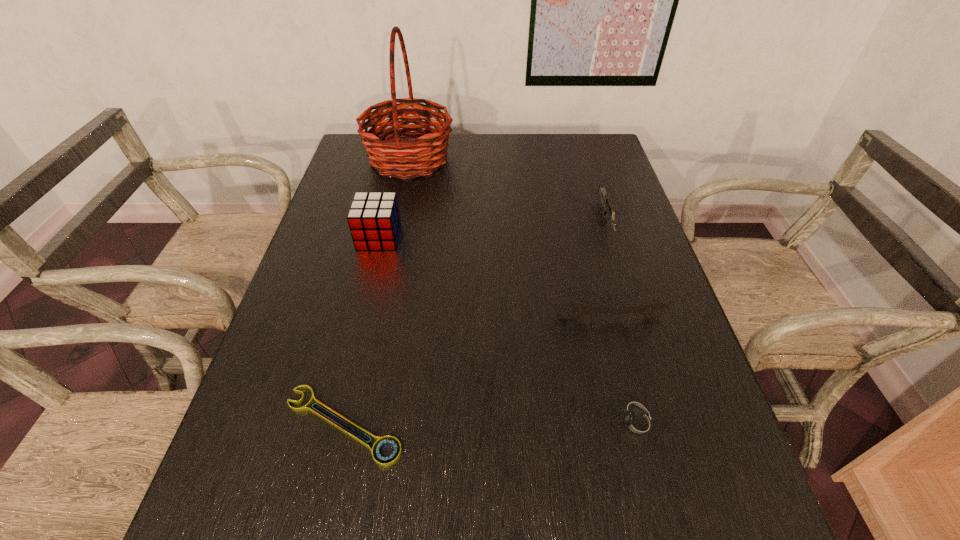
Locate an element on the screen. This screenshot has width=960, height=540. the farthest object is located at coordinates (428, 151).

You are a GUI agent. You are given a task and a screenshot of the screen. Output one action in this format:
    pyautogui.click(x=<x>, y=<y>)
    Task: Click on the basket
    The width and height of the screenshot is (960, 540).
    Given the screenshot: What is the action you would take?
    pyautogui.click(x=428, y=151)

Where is `cube`? cube is located at coordinates (374, 220).

This screenshot has width=960, height=540. In order to click on gun in this screenshot , I will do `click(606, 202)`.

The image size is (960, 540). I want to click on the taller wrench, so click(x=646, y=310).

In order to click on the farther wrench in this screenshot , I will do `click(646, 310)`.

At what (x,y) coordinates should I click in order to perform the action: click on watch. Please return your answer as a coordinate pair (x, y). Looking at the image, I should click on (636, 423).

Find the location of `the left wrench`. the left wrench is located at coordinates (381, 442).

Locate an element on the screen. the shorter wrench is located at coordinates (381, 442).

Find the location of `free location located on the right of the basket`. free location located on the right of the basket is located at coordinates (509, 159).